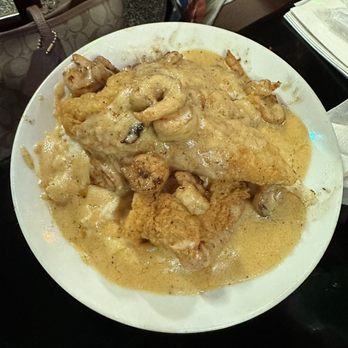
Locate an element on the screen. plate is located at coordinates (178, 309).